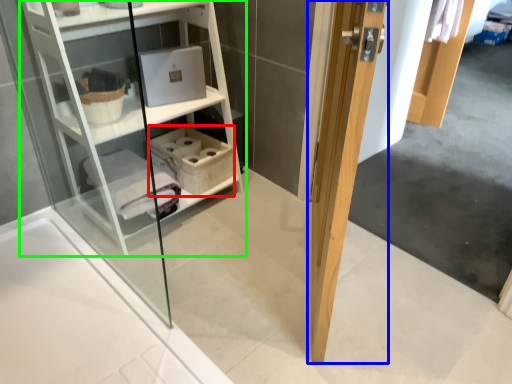
Question: Considering the real-world distances, which object is closest to basket (highlighted by a red box)? door (highlighted by a blue box) or shelf (highlighted by a green box).

Choices:
 (A) door
 (B) shelf

Answer: (B)